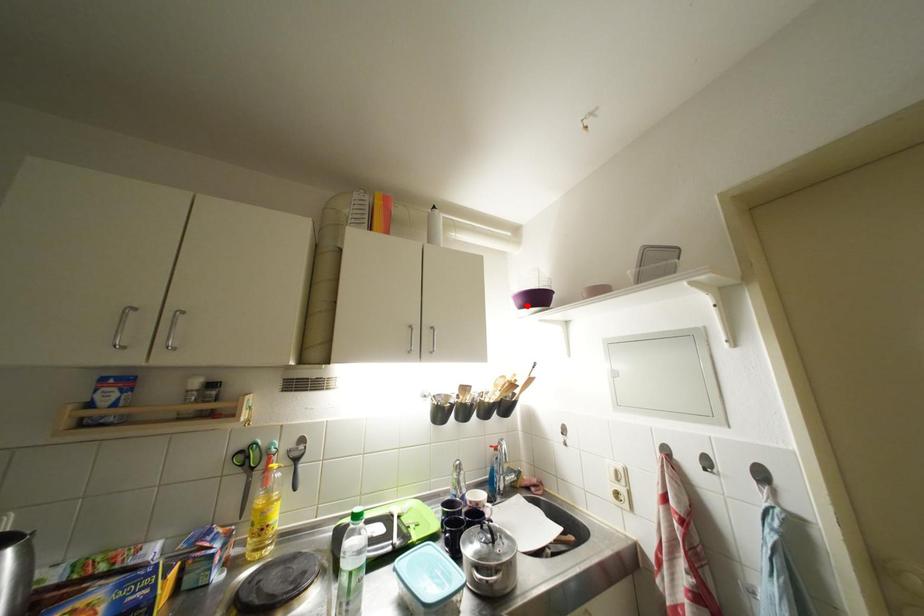
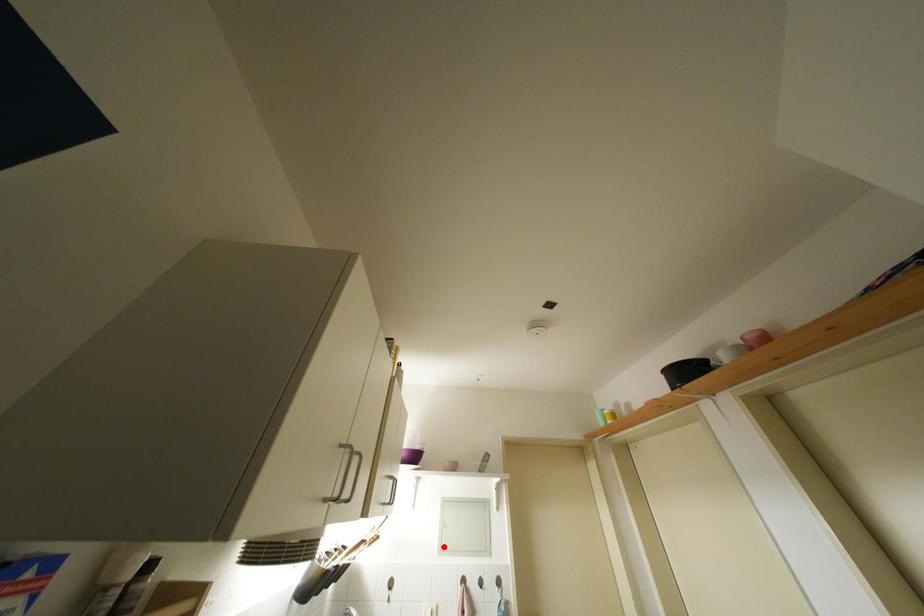
I am providing you with two images of the same scene from different viewpoints. A red point is marked on the first image and another point is marked on the second image. Is the marked point in image1 the same physical position as the marked point in image2?

No